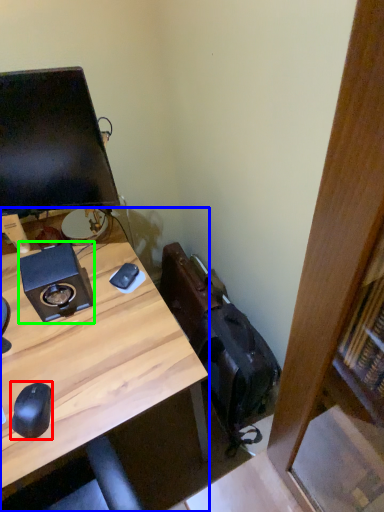
Question: Which is nearer to the mouse (highlighted by a red box)? desk (highlighted by a blue box) or speaker (highlighted by a green box).

Choices:
 (A) desk
 (B) speaker

Answer: (A)